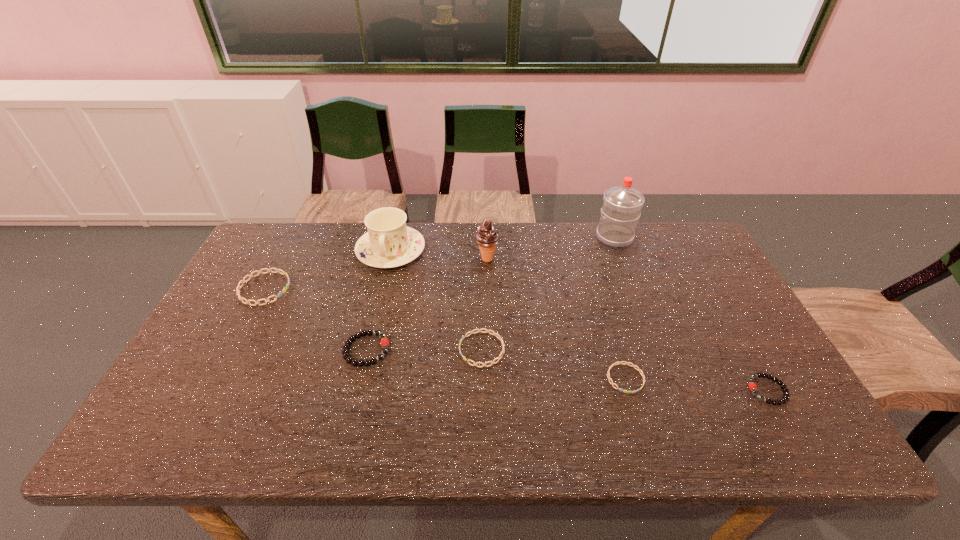
Find the location of a particular element. This screenshot has height=540, width=960. the second smallest blue bracelet is located at coordinates (479, 330).

Where is `the nearer black bracelet`? This screenshot has width=960, height=540. the nearer black bracelet is located at coordinates (x=752, y=386).

In order to click on the smaller black bracelet in this screenshot , I will do click(752, 386).

You are a GUI agent. You are given a task and a screenshot of the screen. Output one action in this format:
    pyautogui.click(x=<x>, y=<y>)
    Task: Click on the smallest blue bracelet
    This screenshot has width=960, height=540.
    Given the screenshot: What is the action you would take?
    pyautogui.click(x=618, y=362)

Find the location of `the second bracelet from right to left`. the second bracelet from right to left is located at coordinates (618, 362).

Locate an element on the screen. free space located on the right of the icecream is located at coordinates (595, 259).

You are a GUI agent. You are given a task and a screenshot of the screen. Output one action in this format:
    pyautogui.click(x=<x>, y=<y>)
    Task: Click on the free space located 0.400m on the handle side of the chinaware
    This screenshot has width=960, height=540.
    Given the screenshot: What is the action you would take?
    pyautogui.click(x=359, y=383)

What are the coordinates of `vacant space located on the surface of the leftmost blue bracelet showing star-shaped elements` in the screenshot? It's located at (424, 288).

Find the location of `vacant space situated on the right of the farther black bracelet`. vacant space situated on the right of the farther black bracelet is located at coordinates (505, 350).

This screenshot has width=960, height=540. What are the coordinates of `free point located on the surface of the third bracelet from right to left showing star-shaped elements` in the screenshot? It's located at (390, 349).